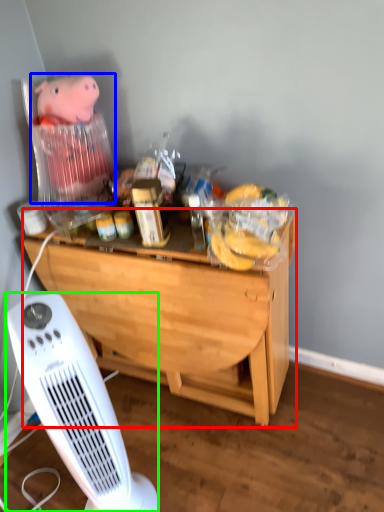
Question: Which object is the closest to the desk (highlighted by a red box)? Choose among these: toy (highlighted by a blue box) or home appliance (highlighted by a green box).

Choices:
 (A) toy
 (B) home appliance

Answer: (B)